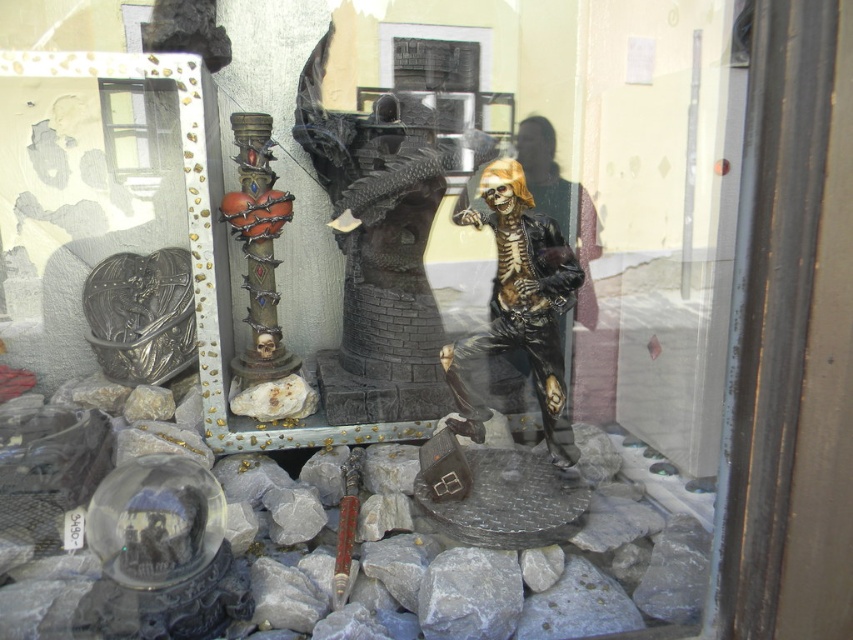
Question: Is silver metallic heart at left below shiny metallic column at center?

Choices:
 (A) yes
 (B) no

Answer: (A)

Question: Is shiny gold skeleton at center wider than shiny metallic column at center?

Choices:
 (A) no
 (B) yes

Answer: (B)

Question: Based on their relative distances, which object is farther from the shiny gold skeleton at center?

Choices:
 (A) silver metallic heart at left
 (B) shiny metallic column at center

Answer: (A)

Question: Which object is farther from the camera taking this photo?

Choices:
 (A) shiny metallic column at center
 (B) shiny gold skeleton at center

Answer: (A)

Question: In this image, where is silver metallic heart at left located relative to shiny metallic column at center?

Choices:
 (A) left
 (B) right

Answer: (A)

Question: Which of the following is the closest to the observer?

Choices:
 (A) (164, 273)
 (B) (497, 326)

Answer: (B)